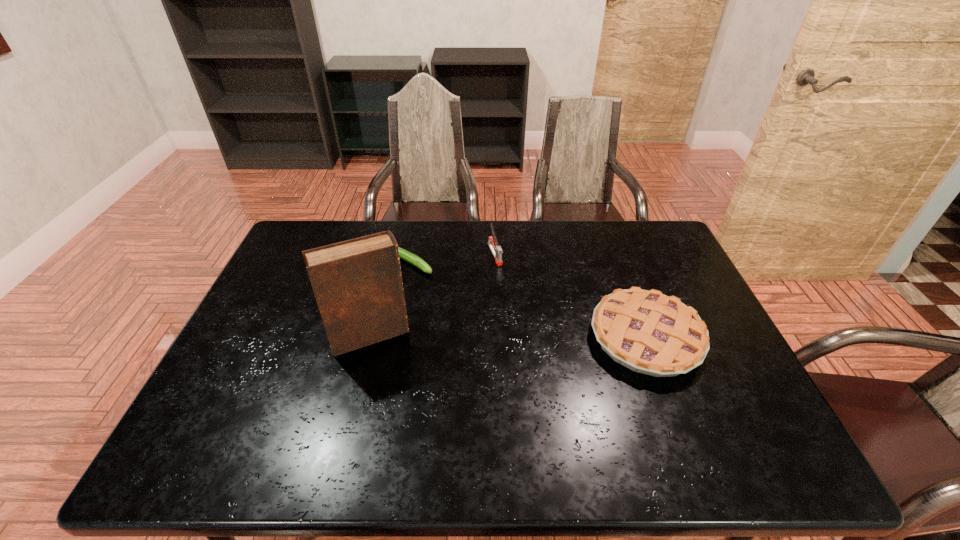
Where is `free space at the right edge`? The width and height of the screenshot is (960, 540). free space at the right edge is located at coordinates (725, 356).

Find the location of a particular element. This screenshot has width=960, height=540. vacant space at the near left corner of the desktop is located at coordinates (225, 406).

Find the location of a particular element. vacant space that is in between the third tallest object and the Bible is located at coordinates (508, 337).

Find the location of a particular element. The image size is (960, 540). free area in between the rightmost object and the Bible is located at coordinates (508, 337).

I want to click on empty location between the tallest object and the third object from left to right, so click(432, 295).

This screenshot has height=540, width=960. I want to click on empty space between the tallest object and the rightmost object, so click(x=508, y=337).

Where is `vacant area between the pie and the third object from left to right`? vacant area between the pie and the third object from left to right is located at coordinates (570, 296).

This screenshot has width=960, height=540. I want to click on vacant space in between the pie and the Bible, so click(x=508, y=337).

The width and height of the screenshot is (960, 540). Identify the location of blank region between the second tallest object and the pie. (570, 296).

The height and width of the screenshot is (540, 960). In order to click on object that ranks as the third closest to the Bible in this screenshot , I will do `click(648, 332)`.